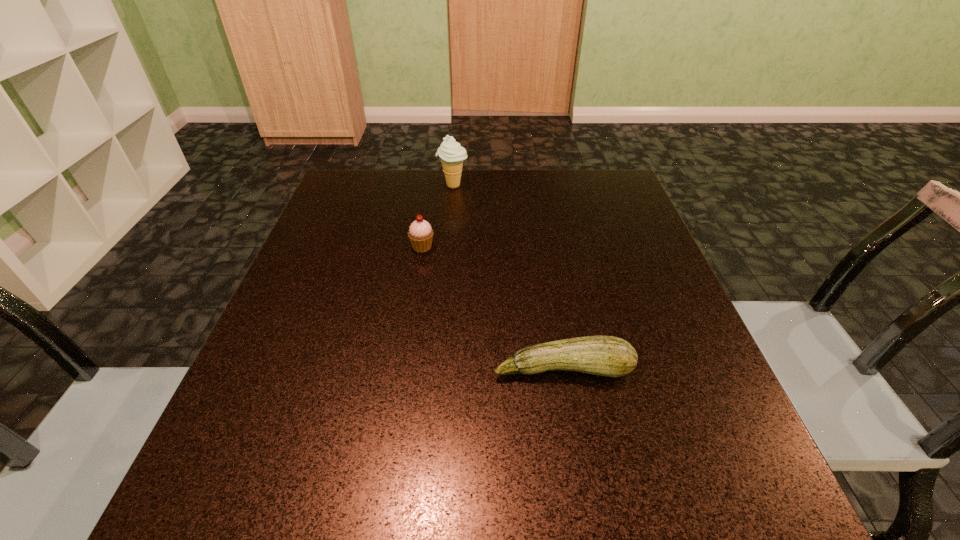
This screenshot has width=960, height=540. Identify the location of object situated at the right edge. (610, 356).

The width and height of the screenshot is (960, 540). Identify the location of vacant space at the far edge of the desktop. (x=451, y=195).

Where is `free space at the near edge`? free space at the near edge is located at coordinates (611, 504).

Locate an element on the screen. The height and width of the screenshot is (540, 960). free space at the left edge of the desktop is located at coordinates (359, 232).

The width and height of the screenshot is (960, 540). I want to click on vacant area at the right edge of the desktop, so click(x=636, y=306).

At what (x,y) coordinates should I click in order to perform the action: click on vacant space at the far left corner of the desktop. Please return your answer as a coordinate pair (x, y). This screenshot has width=960, height=540. Looking at the image, I should click on (337, 200).

In the image, there is a desktop. Identify the location of vacant space at the far right corner. This screenshot has width=960, height=540. (630, 212).

The image size is (960, 540). I want to click on empty location between the tallest object and the second shortest object, so click(438, 216).

What are the coordinates of `free space between the rightmost object and the second nearest object` in the screenshot? It's located at (492, 308).

Image resolution: width=960 pixels, height=540 pixels. I want to click on vacant area that lies between the rightmost object and the second shortest object, so click(492, 308).